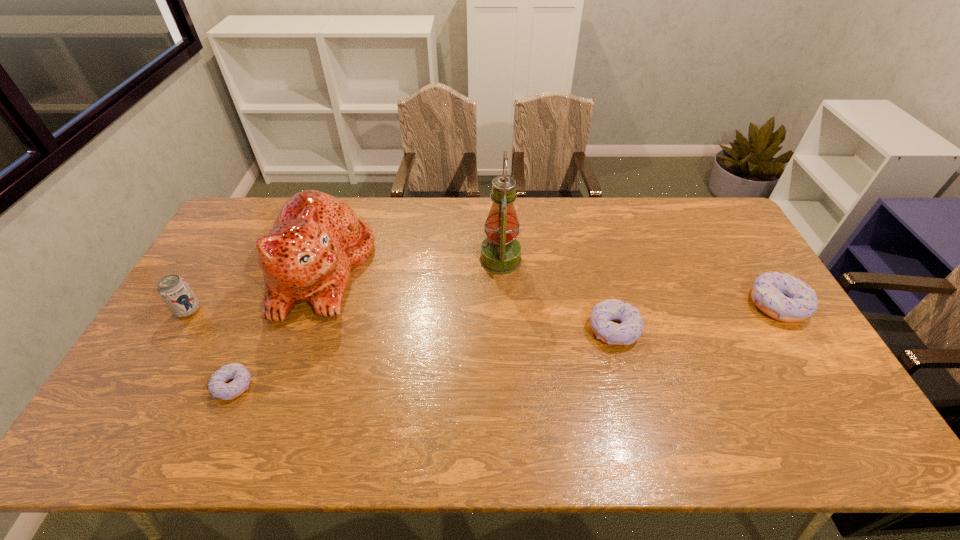
Locate an element on the screen. This screenshot has width=960, height=540. vacant space that is in between the second shortest doughnut and the nearest doughnut is located at coordinates (423, 357).

This screenshot has height=540, width=960. I want to click on unoccupied position between the fourth object from left to right and the second tallest doughnut, so click(x=557, y=295).

The image size is (960, 540). Find the location of `free spot between the nearest object and the third tallest object`. free spot between the nearest object and the third tallest object is located at coordinates (211, 348).

Image resolution: width=960 pixels, height=540 pixels. I want to click on vacant space that's between the rightmost doughnut and the cat, so click(549, 287).

What are the coordinates of `free point between the shortest doughnut and the cat` in the screenshot? It's located at (277, 328).

You are a GUI agent. You are given a task and a screenshot of the screen. Output one action in this format:
    pyautogui.click(x=<x>, y=<y>)
    Task: Click on the vacant area that lies between the rightmost object and the beer can
    
    Given the screenshot: What is the action you would take?
    pyautogui.click(x=483, y=308)

At what (x,y) coordinates should I click in order to perform the action: click on the fourth closest object to the tallest object. Please return your answer as a coordinate pair (x, y). The height and width of the screenshot is (540, 960). Looking at the image, I should click on (217, 386).

Where is `object that is the second nearest to the third tallest object`? The image size is (960, 540). object that is the second nearest to the third tallest object is located at coordinates (217, 386).

Select which doughnut appears as the second closest to the rightmost object. Please provide its 2D coordinates. Your answer should be formatted as a tuple, i.e. [(x, y)], where the tuple contains the x and y coordinates of a point satisfying the conditions above.

[(217, 386)]

Choose which doughnut is the second nearest neighbor to the shortest doughnut. Please provide its 2D coordinates. Your answer should be formatted as a tuple, i.e. [(x, y)], where the tuple contains the x and y coordinates of a point satisfying the conditions above.

[(786, 298)]